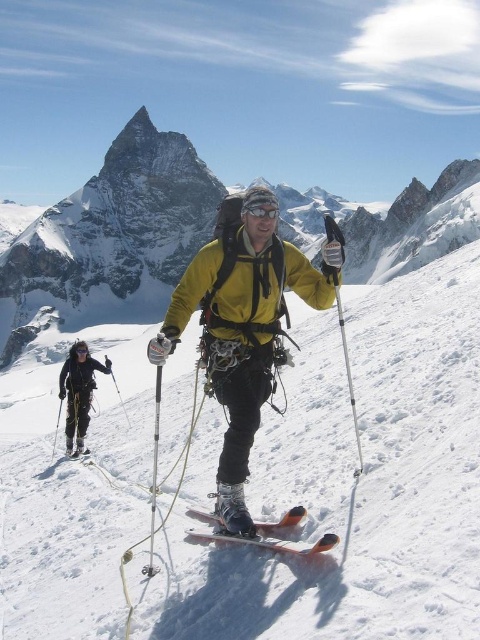
You are a mountaineer planning to place a marker on the white matte snow at center and the black matte goggles at upper center. Which object should you place the marker closer to your current position to ensure it is visible from where you stand?

You should place the marker on the white matte snow at center because it is closer to the viewer than the black matte goggles at upper center, making it more visible from your current position.

You are planning to take a photo of the white snow mountain at upper left and the orange metallic ski at center. Which object should you focus on first if you want to capture both in the same frame without moving the camera?

You should focus on the white snow mountain at upper left first because it is larger in size than the orange metallic ski at center, making it the primary subject for the frame.

You are planning to place a small flag on the highest point between the white matte snow at center and the black matte goggles at upper center. Which object should you choose to place the flag on?

The white matte snow at center is much taller than the black matte goggles at upper center, so you should place the flag on the white matte snow at center.